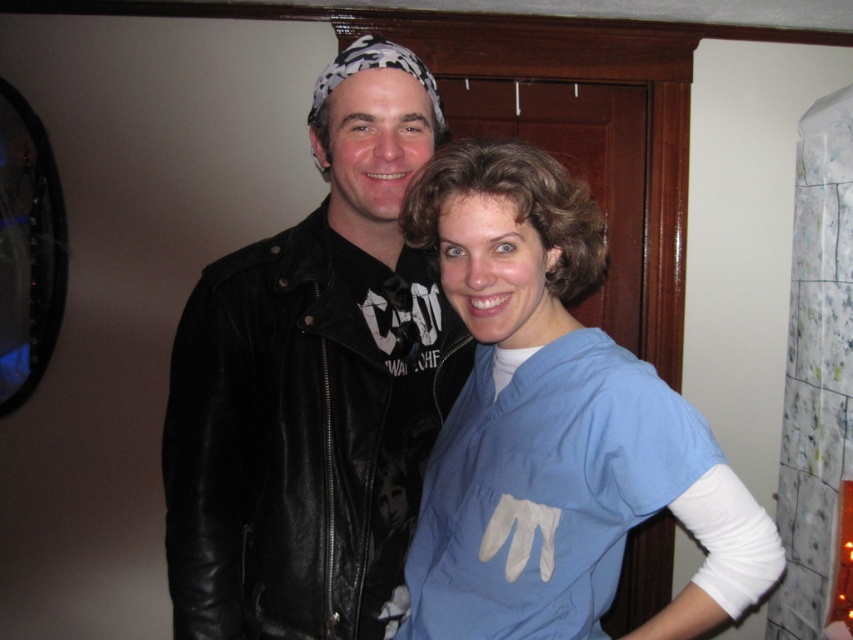
Can you confirm if black leather jacket at center is taller than blue scrubs at center?

Correct, black leather jacket at center is much taller as blue scrubs at center.

Is black leather jacket at center shorter than blue scrubs at center?

In fact, black leather jacket at center may be taller than blue scrubs at center.

Describe the element at coordinates (312, 385) in the screenshot. I see `black leather jacket at center` at that location.

At what (x,y) coordinates should I click in order to perform the action: click on black leather jacket at center. Please return your answer as a coordinate pair (x, y). This screenshot has width=853, height=640. Looking at the image, I should click on [312, 385].